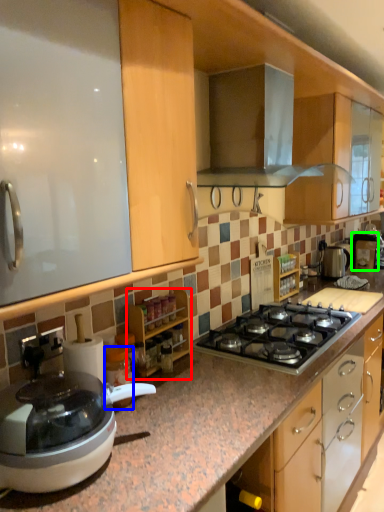
Question: Considering the real-world distances, which object is farthest from cabinetry (highlighted by a red box)? appliance (highlighted by a blue box) or coffee machine (highlighted by a green box)?

Choices:
 (A) appliance
 (B) coffee machine

Answer: (B)